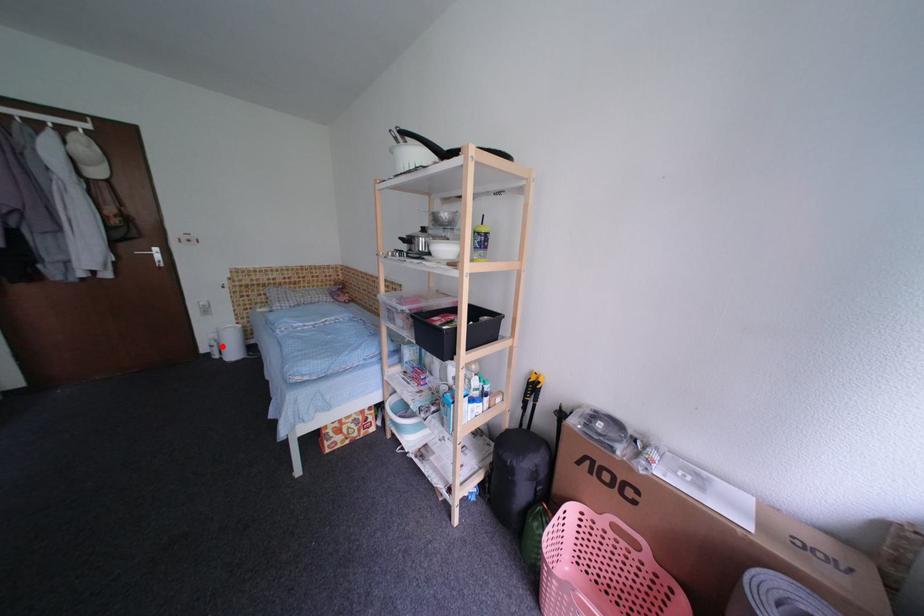
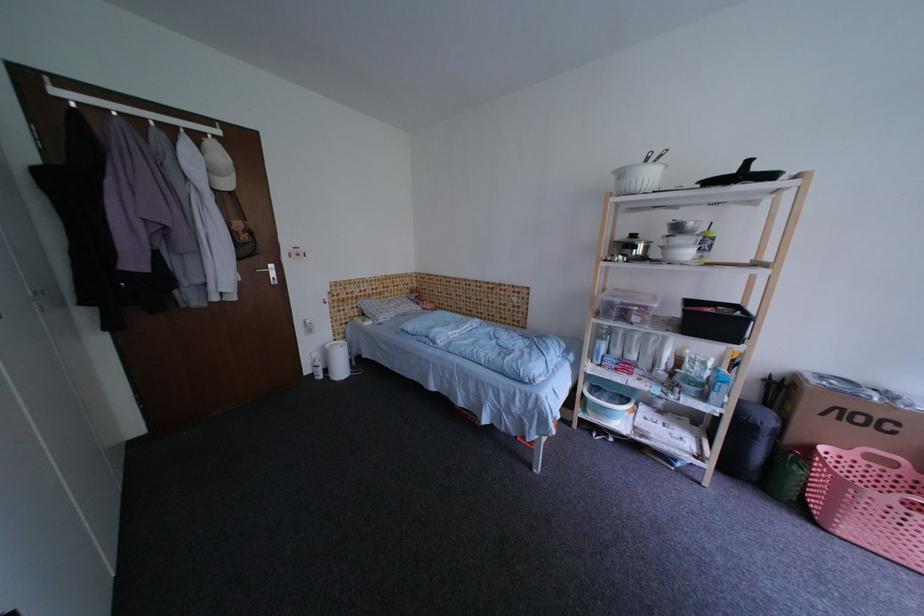
Where in the second image is the point corresponding to the highlighted location from the first image?

(326, 366)